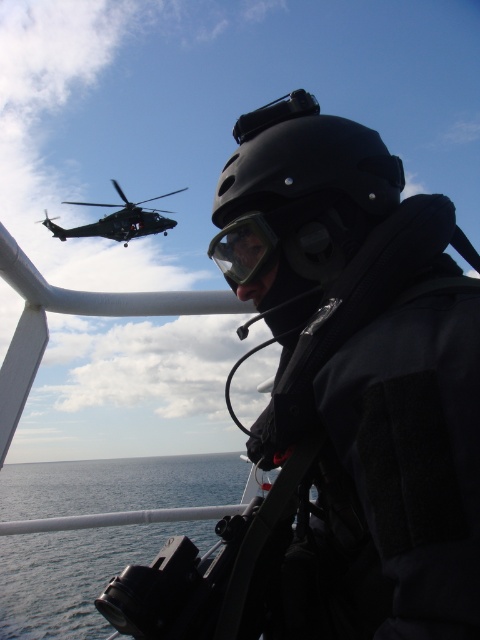
Who is higher up, black matte helmet at center or transparent plastic goggles at center?

black matte helmet at center is higher up.

I want to click on black matte helmet at center, so click(300, 193).

What are the coordinates of `black matte helmet at center` in the screenshot? It's located at (300, 193).

Is point (237, 141) positioned behind point (176, 192)?

No.

Between black matte helmet at center and dark gray matte helicopter at upper left, which one is positioned lower?

black matte helmet at center

This screenshot has height=640, width=480. What do you see at coordinates (300, 193) in the screenshot?
I see `black matte helmet at center` at bounding box center [300, 193].

Identify the location of black matte helmet at center. (300, 193).

Can you confirm if transparent plastic goggles at center is taller than dark gray matte helicopter at upper left?

Incorrect, transparent plastic goggles at center's height is not larger of dark gray matte helicopter at upper left's.

Who is more distant from viewer, (264, 241) or (71, 228)?

The point (71, 228) is behind.

Which is in front, point (252, 240) or point (108, 230)?

Positioned in front is point (252, 240).

Find the location of a particular element. This screenshot has height=640, width=480. transparent plastic goggles at center is located at coordinates (243, 248).